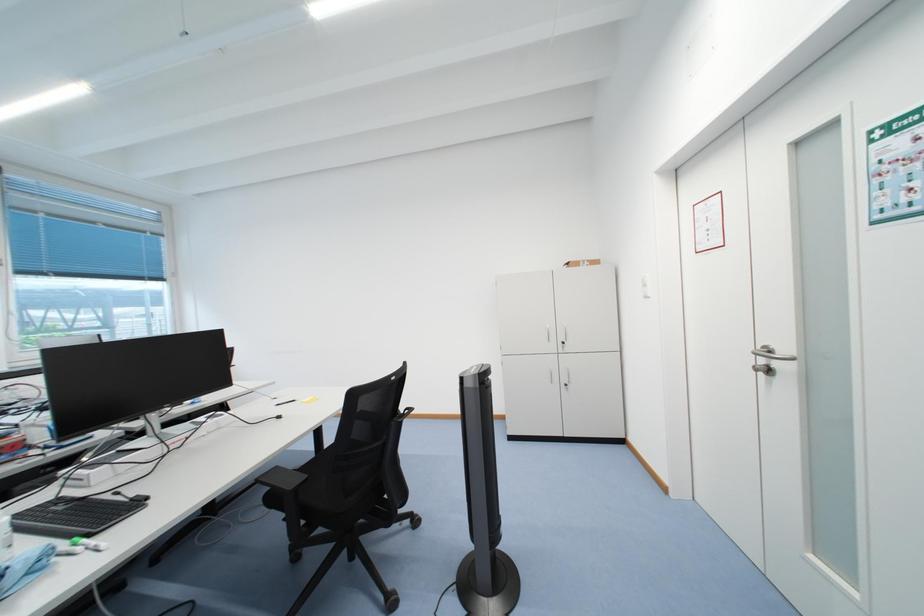
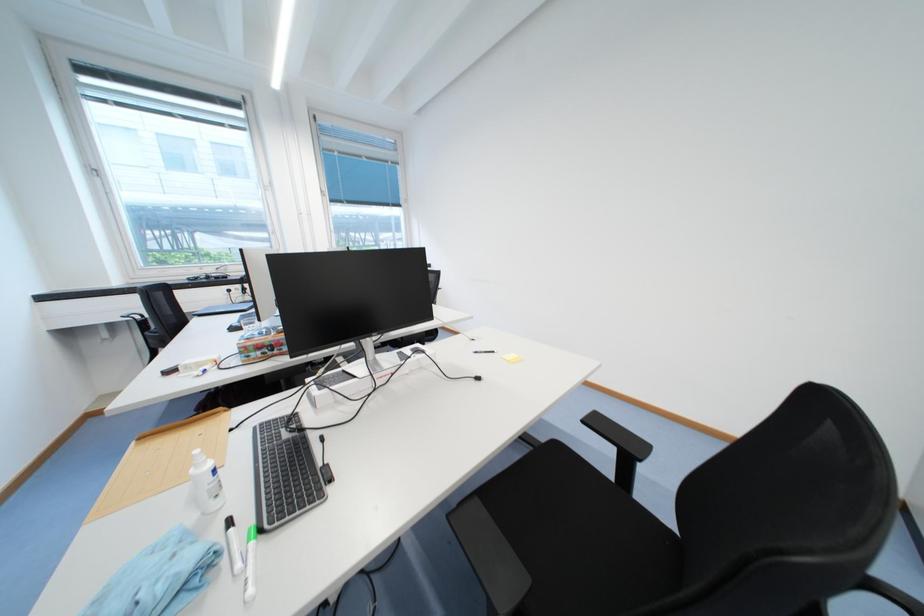
The first image is from the beginning of the video and the second image is from the end. How did the camera likely rotate when shooting the video?

The camera's rotation is toward left-down.